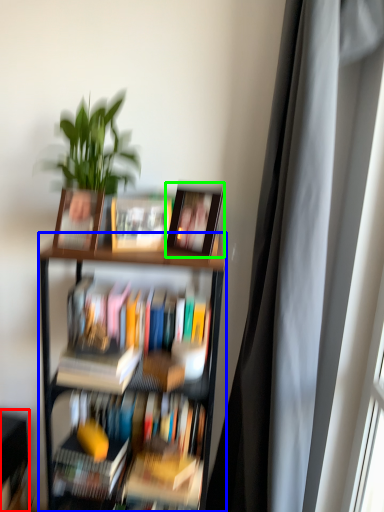
Question: Which is nearer to the shelf (highlighted by a red box)? bookcase (highlighted by a blue box) or picture frame (highlighted by a green box).

Choices:
 (A) bookcase
 (B) picture frame

Answer: (A)